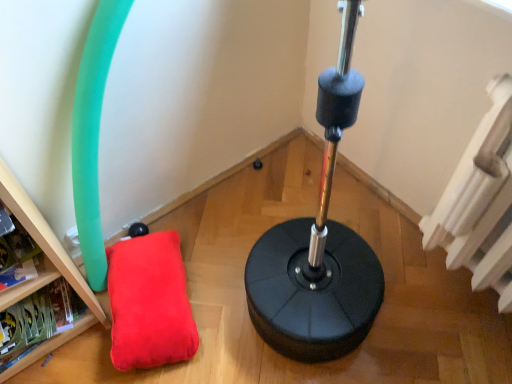
In order to click on vacant area on top of velvet red pillow at lower left (from a real-world perspective) in this screenshot , I will do `click(142, 296)`.